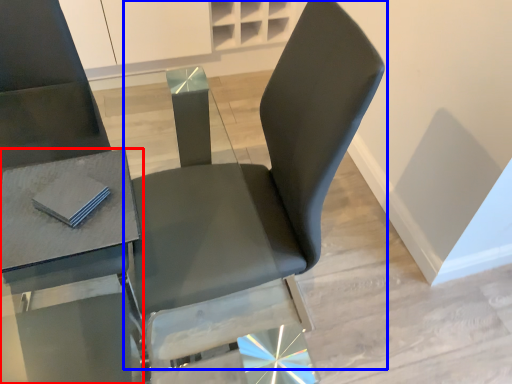
Question: Which object is further to the camera taking this photo, table (highlighted by a red box) or chair (highlighted by a blue box)?

Choices:
 (A) table
 (B) chair

Answer: (B)